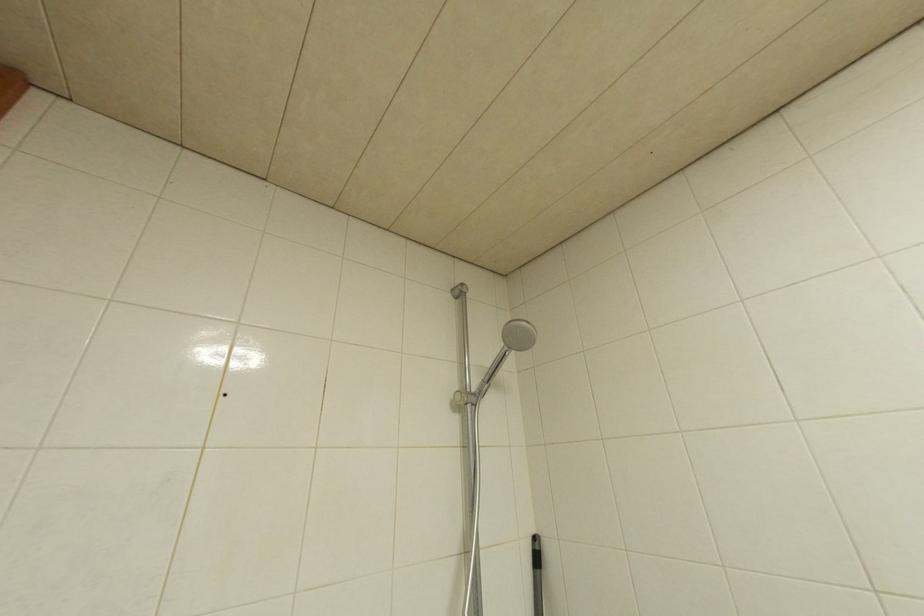
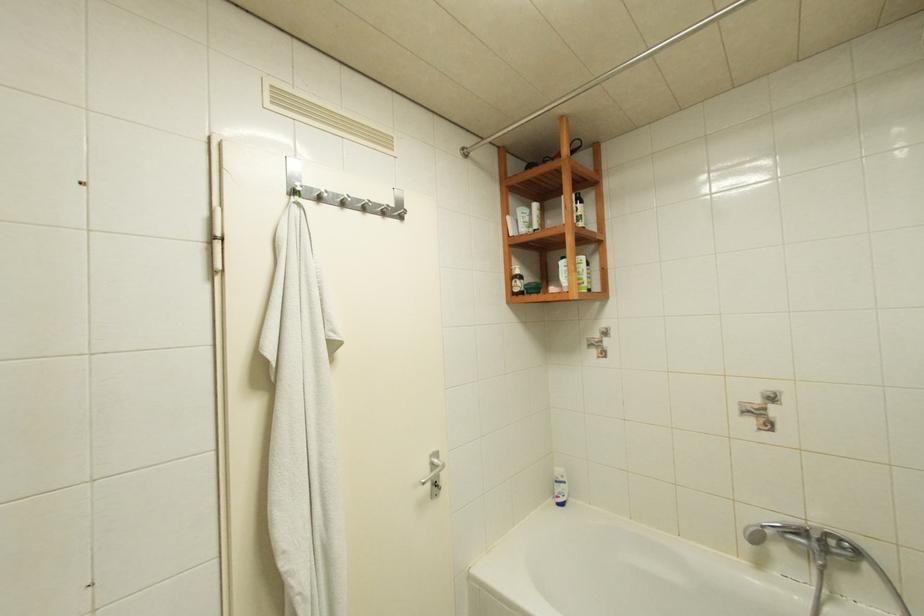
Question: The first image is from the beginning of the video and the second image is from the end. How did the camera likely rotate when shooting the video?

Choices:
 (A) Left
 (B) Right
 (C) Up
 (D) Down

Answer: (B)